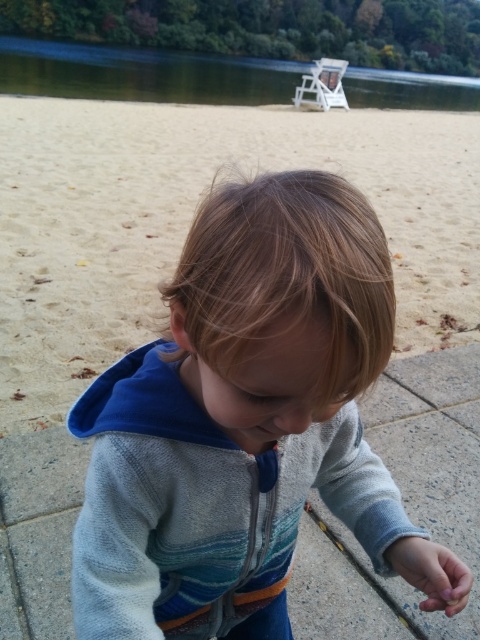
Consider the image. Can you confirm if gray fleece hoodie at center is positioned below sandy at lower center?

Indeed, gray fleece hoodie at center is positioned under sandy at lower center.

Describe the element at coordinates (245, 424) in the screenshot. The width and height of the screenshot is (480, 640). I see `gray fleece hoodie at center` at that location.

Which is behind, point (115, 621) or point (38, 106)?

The point (38, 106) is more distant.

Image resolution: width=480 pixels, height=640 pixels. I want to click on gray fleece hoodie at center, so click(245, 424).

Is gray fleece hoodie at center positioned behind green smooth water at upper center?

No, it is not.

Does gray fleece hoodie at center come in front of green smooth water at upper center?

Yes.

Is point (283, 285) behind point (17, 54)?

That is False.

Identify the location of gray fleece hoodie at center. This screenshot has width=480, height=640. (x=245, y=424).

Is sandy at lower center shorter than green smooth water at upper center?

Correct, sandy at lower center is not as tall as green smooth water at upper center.

Who is more forward, (162, 192) or (6, 90)?

Point (162, 192) is more forward.

The width and height of the screenshot is (480, 640). I want to click on sandy at lower center, so click(x=192, y=216).